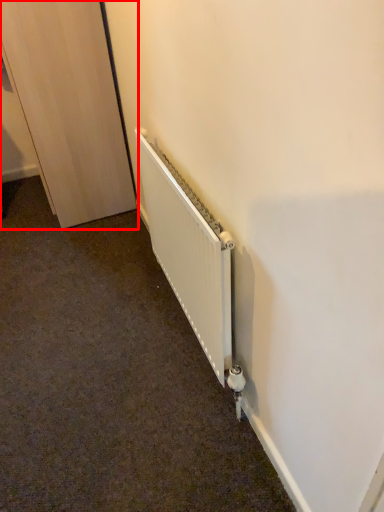
Question: In this image, where is door (annotated by the red box) located relative to radiator?

Choices:
 (A) right
 (B) left

Answer: (B)